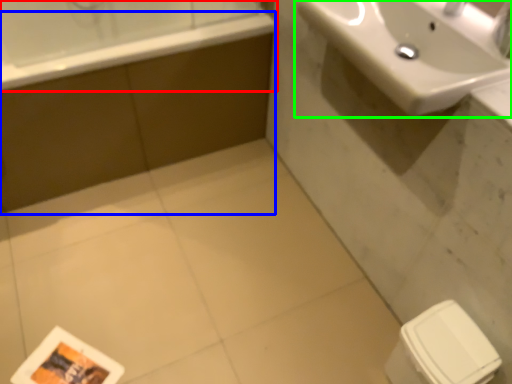
Question: Which object is the closest to the bathtub (highlighted by a red box)? Choose among these: bath (highlighted by a blue box) or sink (highlighted by a green box).

Choices:
 (A) bath
 (B) sink

Answer: (A)